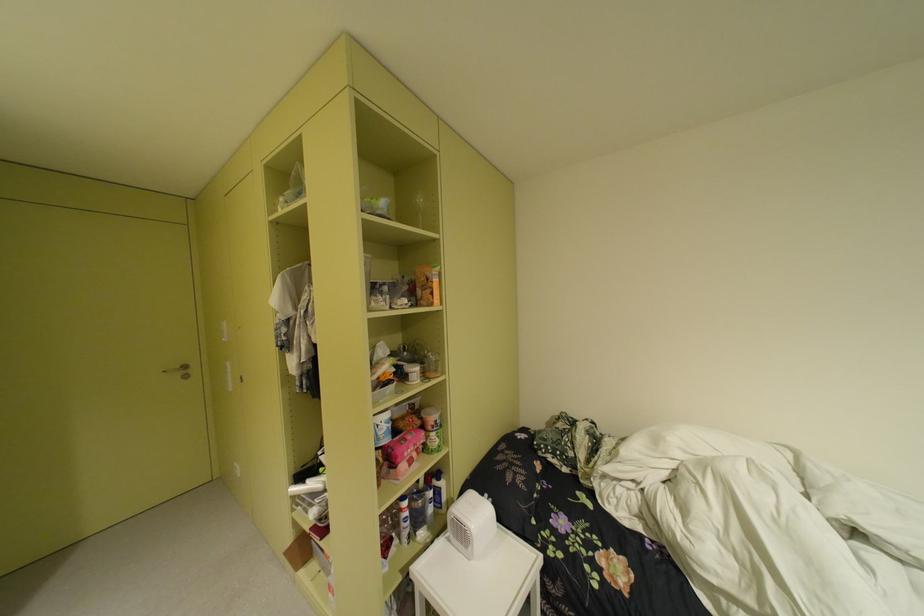
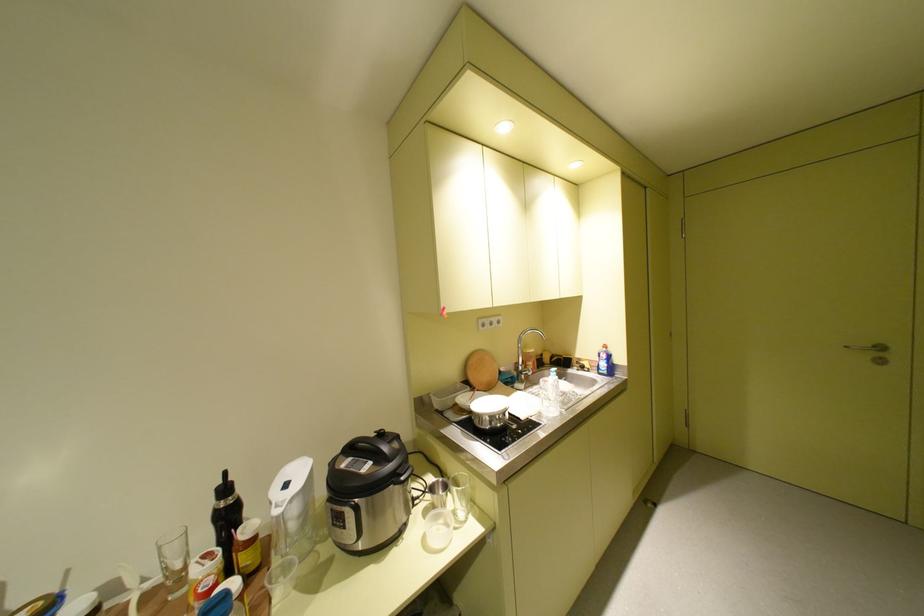
Where in the second image is the point corresponding to point 175,371 from the first image?

(857, 347)